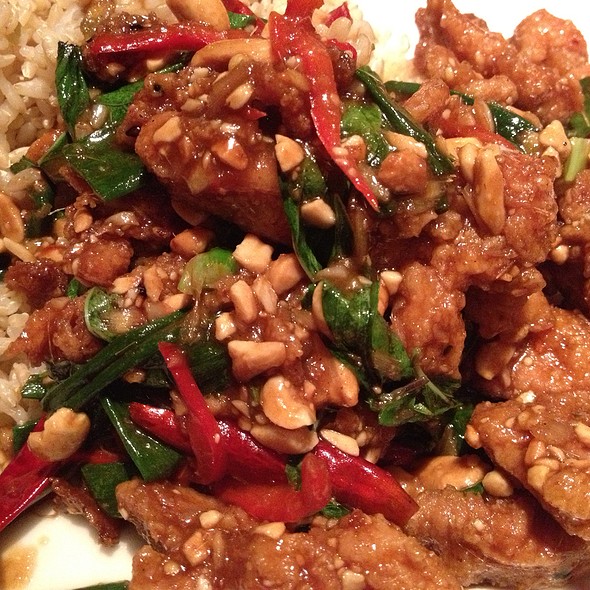
Locate an element on the screen. The width and height of the screenshot is (590, 590). white plate is located at coordinates (81, 559).